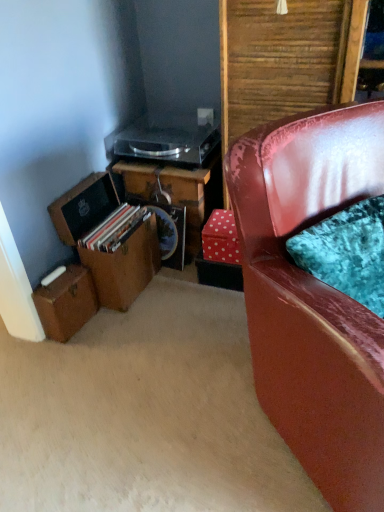
Locate an element on the screen. The width and height of the screenshot is (384, 512). spots to the right of brown leather suitcase at lower left, which ranks as the 1th box in bottom-to-top order is located at coordinates (111, 327).